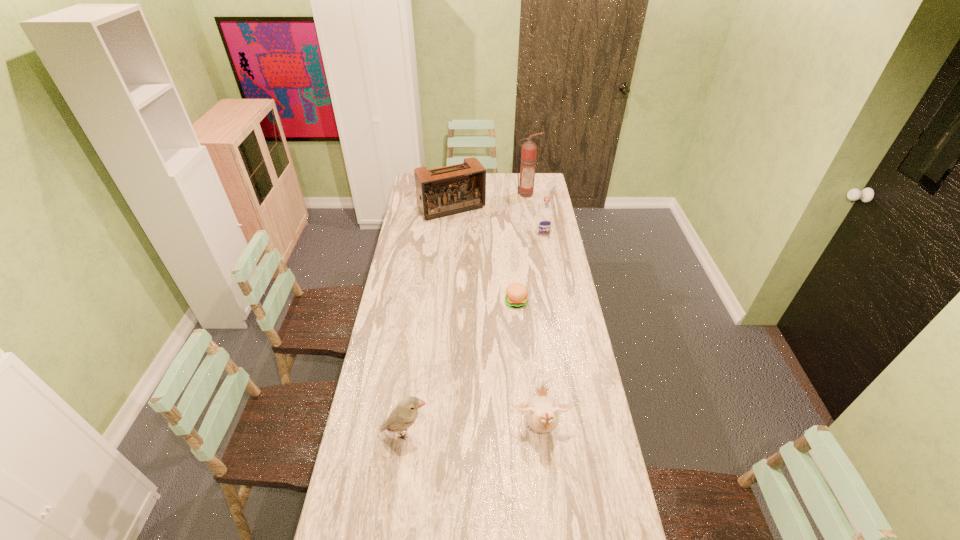
This screenshot has height=540, width=960. What are the coordinates of `fire extinguisher` in the screenshot? It's located at (529, 149).

What are the coordinates of `the second tallest object` in the screenshot? It's located at (440, 192).

This screenshot has height=540, width=960. Find the location of `the fourth nearest object`. the fourth nearest object is located at coordinates (544, 219).

In order to click on the left bird in this screenshot , I will do `click(404, 415)`.

The height and width of the screenshot is (540, 960). I want to click on the right bird, so click(x=541, y=412).

This screenshot has width=960, height=540. Identify the location of hamburger. (516, 296).

Image resolution: width=960 pixels, height=540 pixels. What are the coordinates of `the shortest object` in the screenshot? It's located at (516, 296).

The height and width of the screenshot is (540, 960). I want to click on vacant space located 0.270m on the side of the fire extinguisher with the label and nozzle, so click(x=530, y=225).

You are a GUI agent. You are given a task and a screenshot of the screen. Output one action in this format:
    pyautogui.click(x=<x>, y=<y>)
    Task: Click on the free space located on the right of the radio receiver
    
    Given the screenshot: What is the action you would take?
    pyautogui.click(x=550, y=208)

Locate an element on the screen. The width and height of the screenshot is (960, 540). vacant space situated on the label of the vodka is located at coordinates (547, 256).